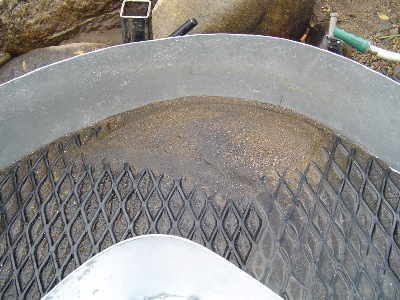
Find the location of `interior`. interior is located at coordinates (100, 104), (130, 6), (154, 277).